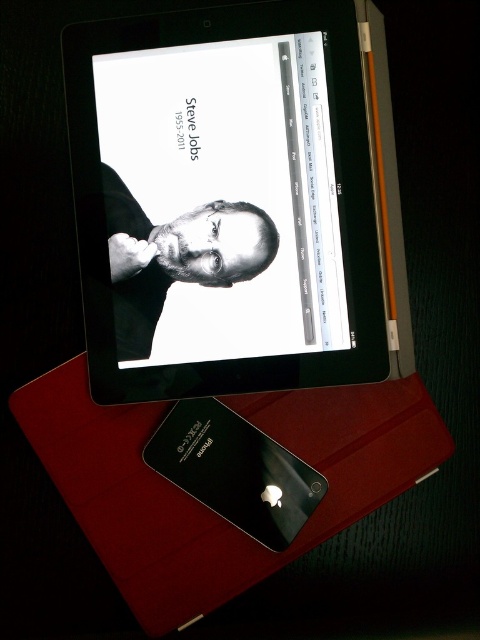
Question: Does black glossy tablet at upper center lie in front of black glossy tablet at center?

Choices:
 (A) yes
 (B) no

Answer: (A)

Question: Which is farther from the black glossy tablet at center?

Choices:
 (A) black matte portrait at center
 (B) black glossy tablet at upper center

Answer: (B)

Question: Does black glossy tablet at upper center have a greater width compared to black matte portrait at center?

Choices:
 (A) no
 (B) yes

Answer: (B)

Question: Is black glossy tablet at upper center below black matte portrait at center?

Choices:
 (A) no
 (B) yes

Answer: (A)

Question: Which object appears farthest from the camera in this image?

Choices:
 (A) black glossy tablet at center
 (B) black glossy tablet at upper center

Answer: (A)

Question: Which point is closer to the camera?

Choices:
 (A) black glossy tablet at upper center
 (B) black glossy tablet at center

Answer: (A)